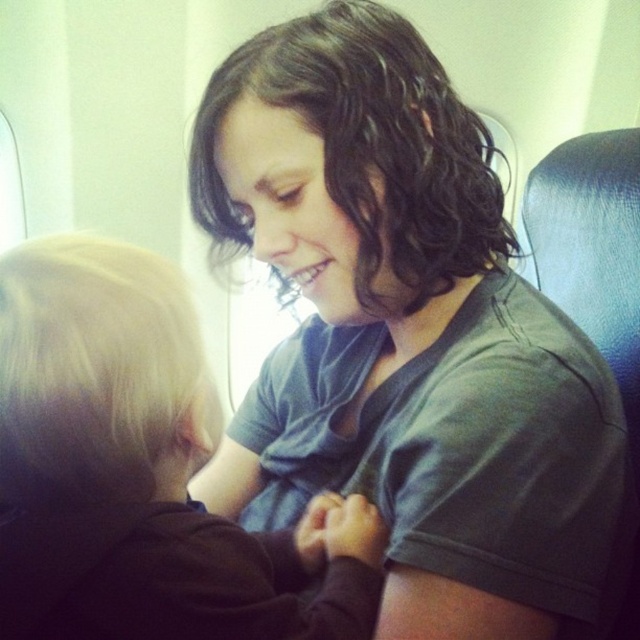
Is dark green fabric shirt at center closer to the viewer compared to dark brown hair at upper center?

No, it is not.

Is point (317, 202) farther from viewer compared to point (4, 268)?

That is True.

What do you see at coordinates (406, 339) in the screenshot?
I see `dark green fabric shirt at center` at bounding box center [406, 339].

Identify the location of dark green fabric shirt at center. (406, 339).